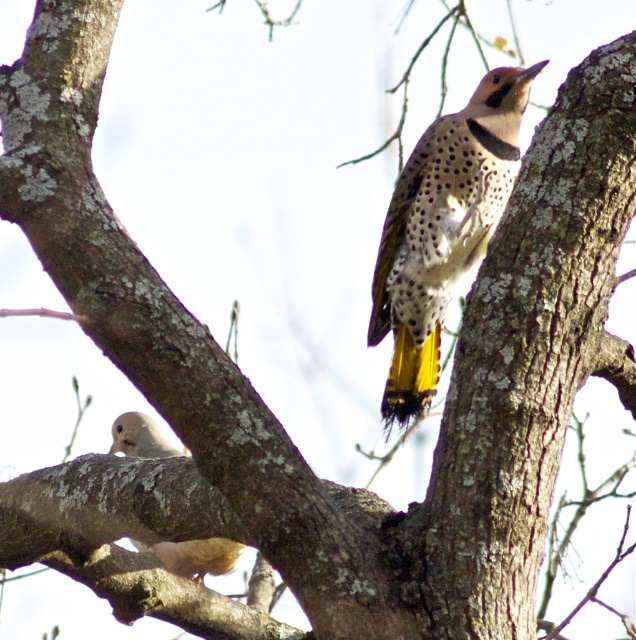
Question: From the image, what is the correct spatial relationship of spotted feathered woodpecker at center in relation to light brown textured owl at lower left?

Choices:
 (A) below
 (B) above

Answer: (B)

Question: Which point appears farthest from the camera in this image?

Choices:
 (A) (398, 403)
 (B) (130, 541)

Answer: (A)

Question: Which of the following is the farthest from the observer?

Choices:
 (A) (492, 147)
 (B) (191, 560)

Answer: (B)

Question: Is spotted feathered woodpecker at center below light brown textured owl at lower left?

Choices:
 (A) yes
 (B) no

Answer: (B)

Question: Can you confirm if spotted feathered woodpecker at center is positioned to the right of light brown textured owl at lower left?

Choices:
 (A) no
 (B) yes

Answer: (B)